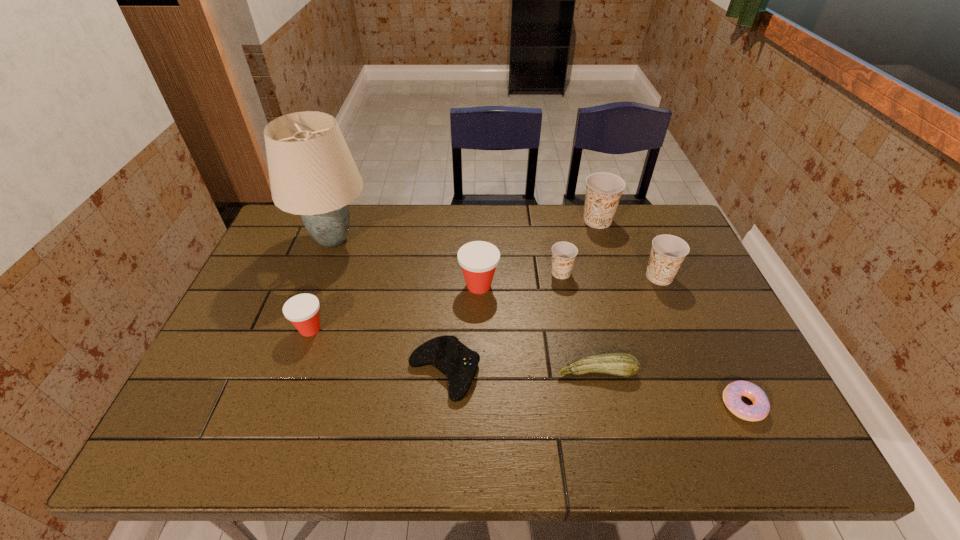
Image resolution: width=960 pixels, height=540 pixels. I want to click on the leftmost orange Dixie cup, so point(563,253).

This screenshot has height=540, width=960. I want to click on the smallest orange Dixie cup, so click(563, 253).

At what (x,y) coordinates should I click in order to perform the action: click on green zucchini. Please return your answer as a coordinate pair (x, y). The width and height of the screenshot is (960, 540). Looking at the image, I should click on click(621, 364).

Where is `control`? The height and width of the screenshot is (540, 960). control is located at coordinates (456, 361).

Where is `pink doughnut`? The image size is (960, 540). pink doughnut is located at coordinates (732, 394).

Locate an element on the screen. doughnut is located at coordinates (732, 394).

I want to click on free space located 0.400m on the front of the lampshade, so click(280, 381).

Where is `vacant space situated on the front of the second tallest object`? This screenshot has width=960, height=540. vacant space situated on the front of the second tallest object is located at coordinates (612, 269).

I want to click on free space located 0.210m on the right of the farther red-orange Dixie cup, so pos(571,286).

The width and height of the screenshot is (960, 540). I want to click on vacant area located 0.220m on the back of the rightmost Dixie cup, so click(x=636, y=221).